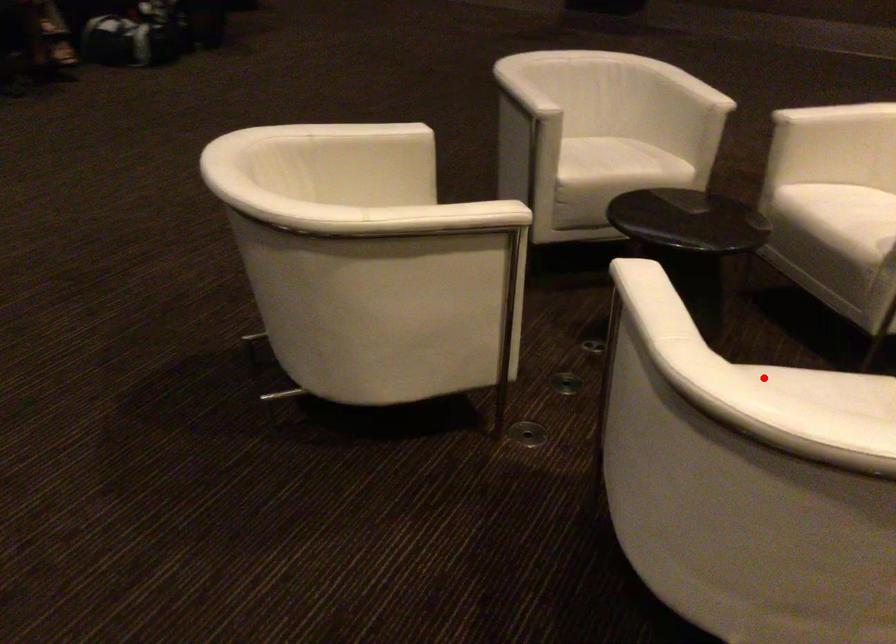
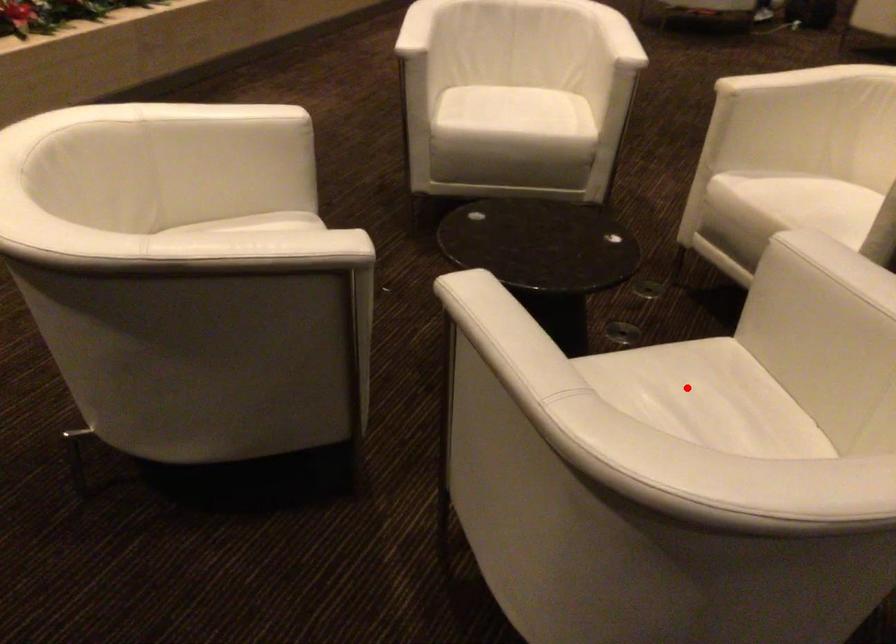
I am providing you with two images of the same scene from different viewpoints. A red point is marked on the first image and another point is marked on the second image. Does the point marked in image1 correspond to the same location as the one in image2?

No